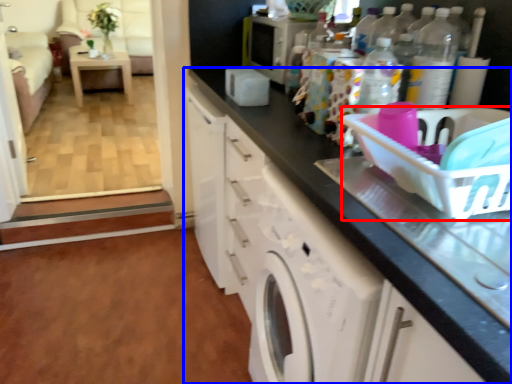
Question: Which point is closer to the camera, basket (highlighted by a red box) or cabinetry (highlighted by a blue box)?

Choices:
 (A) basket
 (B) cabinetry

Answer: (B)